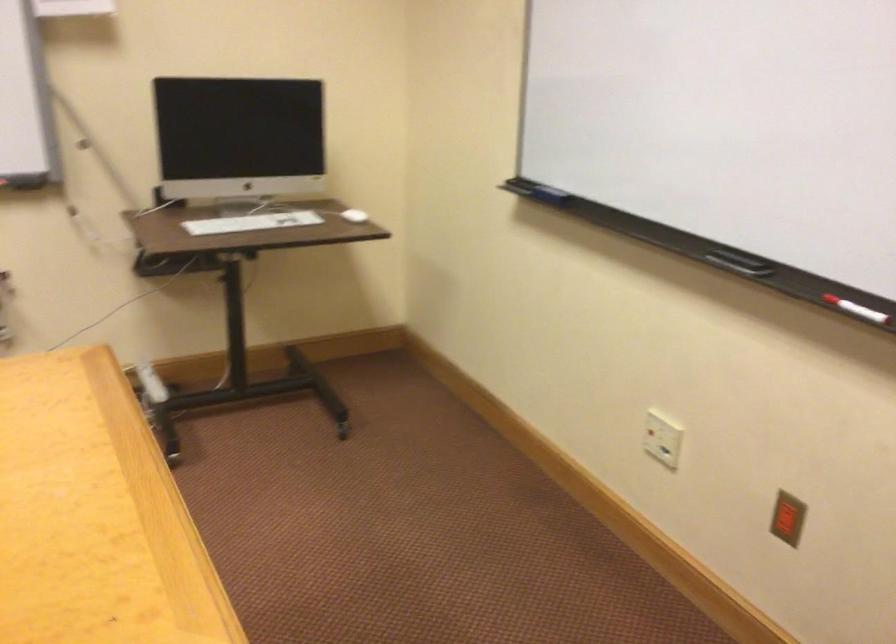
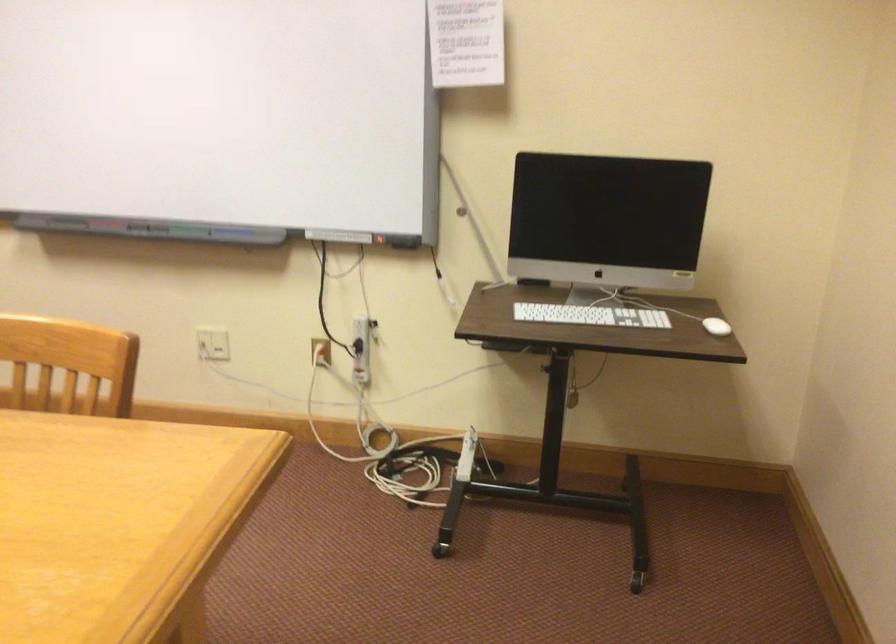
The point at (260, 222) is marked in the first image. Where is the corresponding point in the second image?

(590, 315)